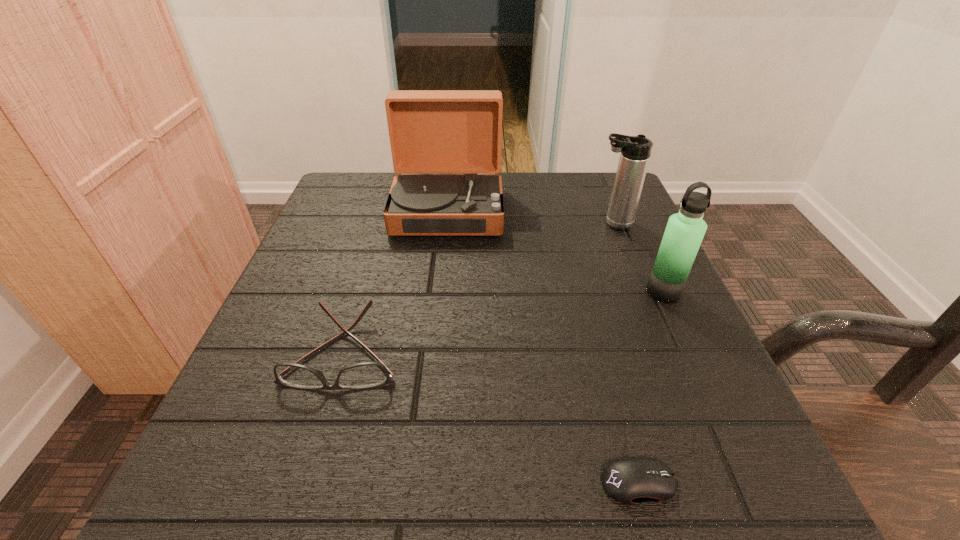
Locate an element on the screen. object positioned at the far left corner is located at coordinates (431, 131).

Identify the location of object present at the far right corner. (635, 151).

Image resolution: width=960 pixels, height=540 pixels. What are the coordinates of `object that is positioned at the near right corner` in the screenshot? It's located at (633, 480).

In order to click on free space at the far edge of the desktop in this screenshot , I will do `click(511, 205)`.

At what (x,y) coordinates should I click in order to perform the action: click on vacant space at the near edge of the desktop. Please return your answer as a coordinate pair (x, y). Looking at the image, I should click on (414, 515).

Image resolution: width=960 pixels, height=540 pixels. I want to click on free region at the right edge of the desktop, so click(x=665, y=336).

Where is `vacant space at the far left corner of the desktop`? The height and width of the screenshot is (540, 960). vacant space at the far left corner of the desktop is located at coordinates (354, 210).

Image resolution: width=960 pixels, height=540 pixels. In the image, there is a desktop. Identify the location of free space at the far right corner. (572, 222).

In the image, there is a desktop. Identify the location of vacant space at the near right corner. (750, 453).

Image resolution: width=960 pixels, height=540 pixels. I want to click on free space that is in between the computer equipment and the fourth tallest object, so click(x=492, y=417).